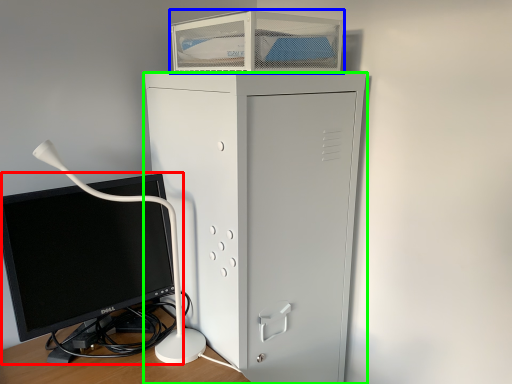
Question: Considering the real-world distances, which object is closest to computer monitor (highlighted by a red box)? desktop (highlighted by a blue box) or furniture (highlighted by a green box).

Choices:
 (A) desktop
 (B) furniture

Answer: (B)